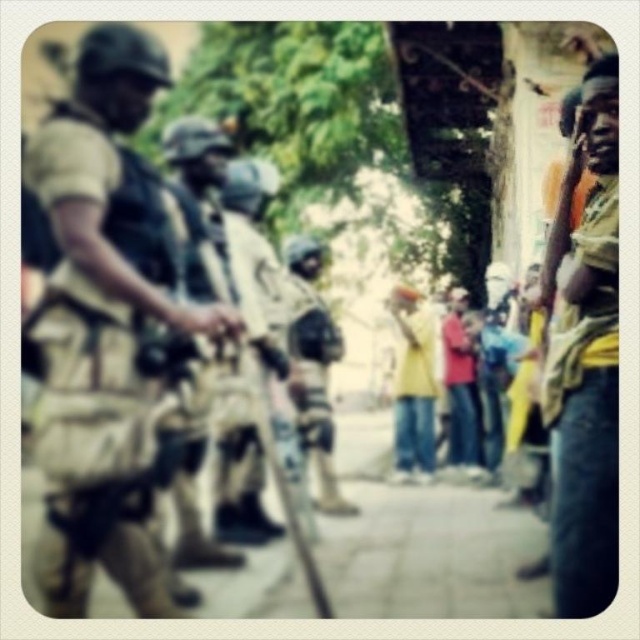
Question: Among these objects, which one is farthest from the camera?

Choices:
 (A) tan uniform at left
 (B) camouflage fabric shirt at right

Answer: (A)

Question: Does tan uniform at left have a larger size compared to camouflage fabric shirt at right?

Choices:
 (A) no
 (B) yes

Answer: (B)

Question: Which object is farther from the camera taking this photo?

Choices:
 (A) tan uniform at left
 (B) camouflage fabric shirt at right

Answer: (A)

Question: Is tan uniform at left to the left of camouflage fabric shirt at right from the viewer's perspective?

Choices:
 (A) no
 (B) yes

Answer: (B)

Question: Is tan uniform at left wider than camouflage fabric shirt at right?

Choices:
 (A) yes
 (B) no

Answer: (A)